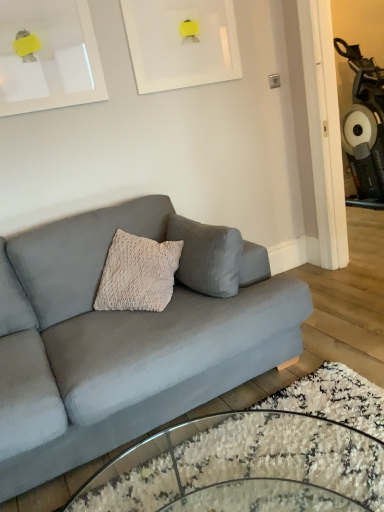
Question: Can you confirm if white matte picture frame at upper center, the 2th picture frame from the right, is thinner than clear glass coffee table at lower center?

Choices:
 (A) no
 (B) yes

Answer: (B)

Question: From a real-world perspective, does white matte picture frame at upper center, which is the first picture frame from left to right, stand above clear glass coffee table at lower center?

Choices:
 (A) yes
 (B) no

Answer: (A)

Question: From a real-world perspective, is white matte picture frame at upper center, which is the first picture frame from left to right, physically below clear glass coffee table at lower center?

Choices:
 (A) no
 (B) yes

Answer: (A)

Question: Can you confirm if white matte picture frame at upper center, the 2th picture frame from the right, is wider than clear glass coffee table at lower center?

Choices:
 (A) yes
 (B) no

Answer: (B)

Question: Is white matte picture frame at upper center, which is the first picture frame from left to right, positioned behind clear glass coffee table at lower center?

Choices:
 (A) no
 (B) yes

Answer: (B)

Question: In terms of height, does white matte picture frame at upper center, the 2th picture frame from the right, look taller or shorter compared to white matte picture frame at upper center, the second picture frame positioned from the left?

Choices:
 (A) short
 (B) tall

Answer: (B)

Question: In terms of size, does white matte picture frame at upper center, which is the first picture frame from left to right, appear bigger or smaller than white matte picture frame at upper center, the 1th picture frame positioned from the right?

Choices:
 (A) small
 (B) big

Answer: (B)

Question: From a real-world perspective, is white matte picture frame at upper center, the 2th picture frame from the right, physically located above or below white matte picture frame at upper center, the 1th picture frame positioned from the right?

Choices:
 (A) below
 (B) above

Answer: (B)

Question: Is white matte picture frame at upper center, the 2th picture frame from the right, spatially inside white matte picture frame at upper center, the 1th picture frame positioned from the right, or outside of it?

Choices:
 (A) outside
 (B) inside

Answer: (A)

Question: Which is correct: clear glass coffee table at lower center is inside matte gray couch at center, or outside of it?

Choices:
 (A) outside
 (B) inside

Answer: (A)

Question: From the image's perspective, is clear glass coffee table at lower center positioned above or below matte gray couch at center?

Choices:
 (A) above
 (B) below

Answer: (B)

Question: Is clear glass coffee table at lower center bigger or smaller than matte gray couch at center?

Choices:
 (A) big
 (B) small

Answer: (B)

Question: Does point (142, 473) appear closer or farther from the camera than point (210, 338)?

Choices:
 (A) closer
 (B) farther

Answer: (A)

Question: Is white matte picture frame at upper center, the 1th picture frame positioned from the right, wider or thinner than clear glass coffee table at lower center?

Choices:
 (A) thin
 (B) wide

Answer: (A)

Question: From a real-world perspective, relative to clear glass coffee table at lower center, is white matte picture frame at upper center, the second picture frame positioned from the left, vertically above or below?

Choices:
 (A) above
 (B) below

Answer: (A)